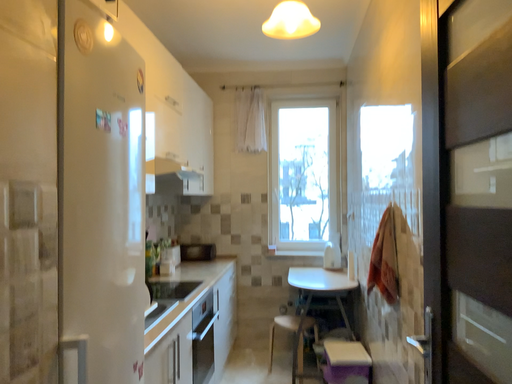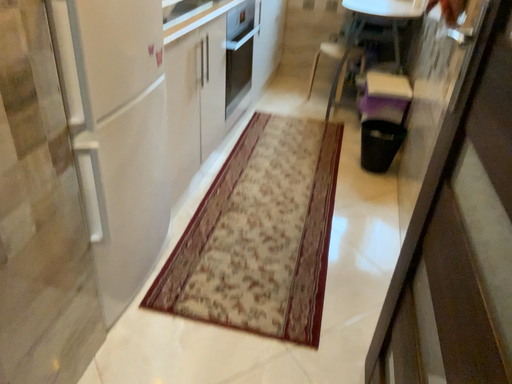
Question: How did the camera likely rotate when shooting the video?

Choices:
 (A) rotated upward
 (B) rotated downward

Answer: (B)